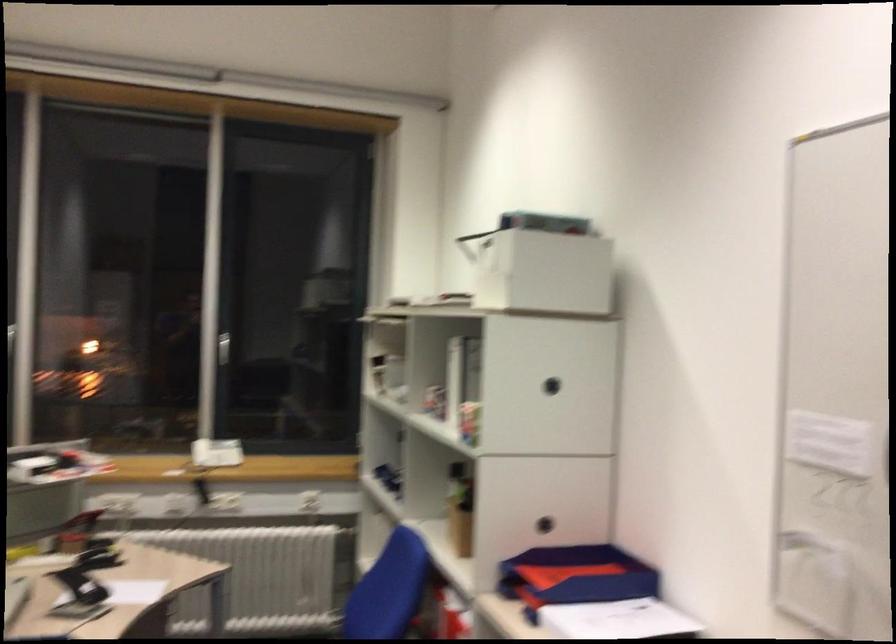
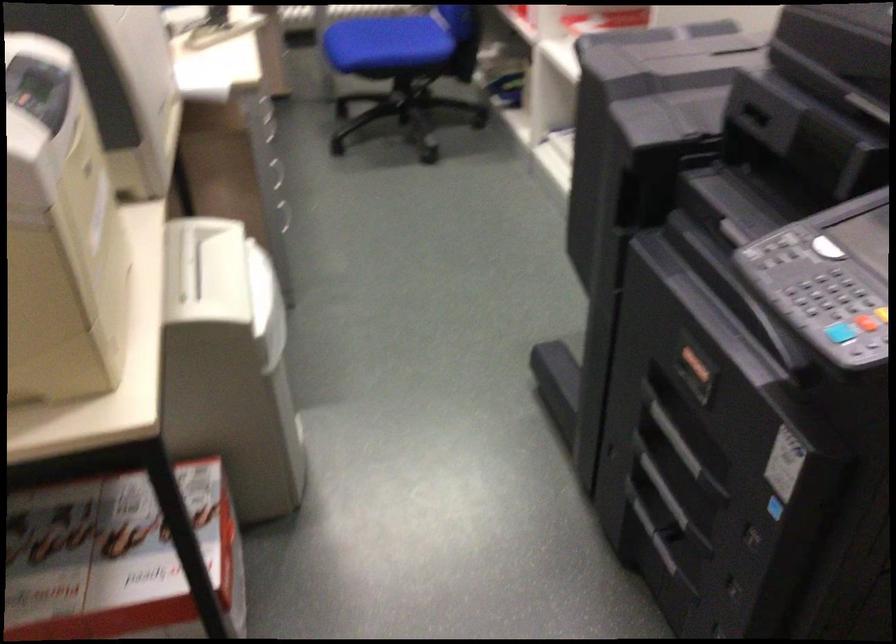
Question: Based on the continuous images, in which direction is the camera rotating? Reply with the corresponding letter.

Choices:
 (A) Left
 (B) Right
 (C) Up
 (D) Down

Answer: (D)